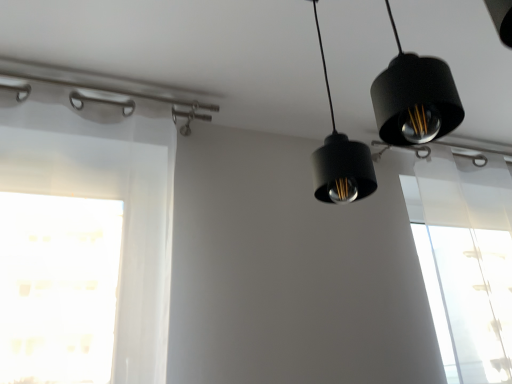
Question: Can you confirm if black matte pendant light at upper center is smaller than transparent fabric at upper right?

Choices:
 (A) no
 (B) yes

Answer: (B)

Question: From a real-world perspective, is black matte pendant light at upper center located higher than transparent fabric at upper right?

Choices:
 (A) no
 (B) yes

Answer: (B)

Question: Can you confirm if black matte pendant light at upper center is shorter than transparent fabric at upper right?

Choices:
 (A) no
 (B) yes

Answer: (B)

Question: Considering the relative sizes of black matte pendant light at upper center and transparent fabric at upper right in the image provided, is black matte pendant light at upper center wider than transparent fabric at upper right?

Choices:
 (A) yes
 (B) no

Answer: (A)

Question: Considering the relative sizes of black matte pendant light at upper center and transparent fabric at upper right in the image provided, is black matte pendant light at upper center taller than transparent fabric at upper right?

Choices:
 (A) yes
 (B) no

Answer: (B)

Question: Does black matte pendant light at upper center come behind transparent fabric at upper right?

Choices:
 (A) no
 (B) yes

Answer: (A)

Question: Would you say transparent fabric at upper right is a long distance from black matte pendant light at upper center?

Choices:
 (A) no
 (B) yes

Answer: (B)

Question: From the image's perspective, is transparent fabric at upper right on top of black matte pendant light at upper center?

Choices:
 (A) yes
 (B) no

Answer: (B)

Question: Is transparent fabric at upper right closer to camera compared to black matte pendant light at upper center?

Choices:
 (A) yes
 (B) no

Answer: (B)

Question: Is black matte pendant light at upper center at the back of transparent fabric at upper right?

Choices:
 (A) yes
 (B) no

Answer: (B)

Question: Is transparent fabric at upper right at the right side of black matte pendant light at upper center?

Choices:
 (A) yes
 (B) no

Answer: (A)

Question: Is transparent fabric at upper right taller than black matte pendant light at upper center?

Choices:
 (A) yes
 (B) no

Answer: (A)

Question: Is black matte pendant light at upper center bigger or smaller than transparent fabric at upper right?

Choices:
 (A) small
 (B) big

Answer: (A)